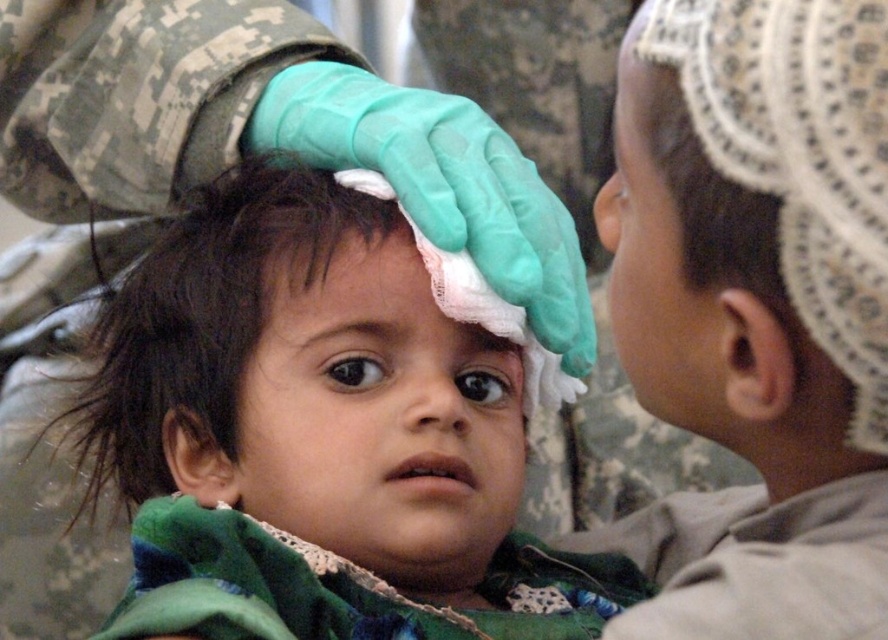
Consider the image. In the scene, there is a child with dark brown hair at center and an adult with white lace forehead at center. Which of these two items is larger in size?

The dark brown hair at center is bigger than the white lace forehead at center.

You are a photographer adjusting your camera to focus on two points in the image. The first point is at coordinates point (361, 218) and the second is at point (403, 237). Which point is closer to your camera?

Point (361, 218) is closer to the camera because it is further to the viewer than point (403, 237).

You are a photographer adjusting your camera settings to capture the intricate details of the laces in the scene. You notice the white lace headscarf at upper right and the white lace forehead at center. Which lace detail is positioned closer to you?

The white lace headscarf at upper right is closer to the viewer than the white lace forehead at center.